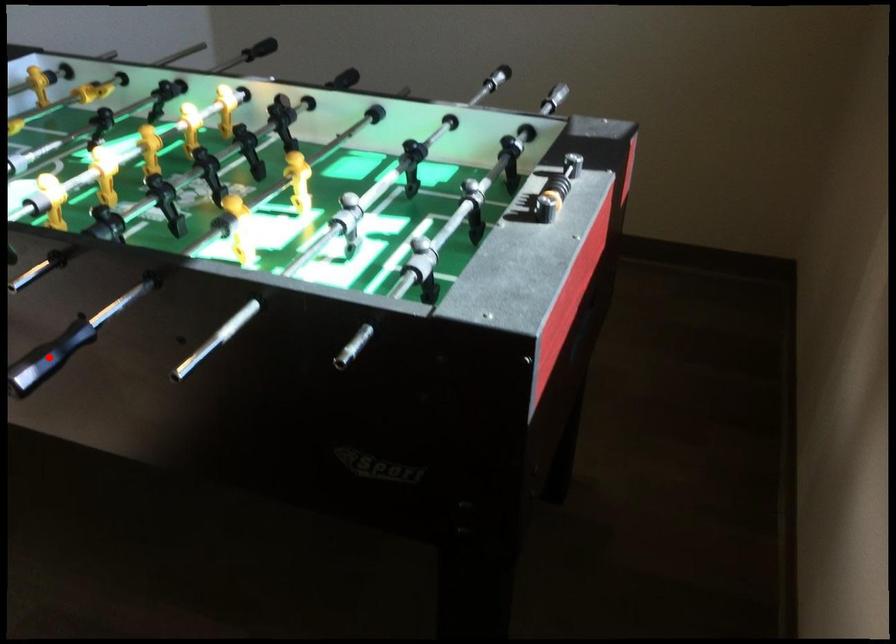
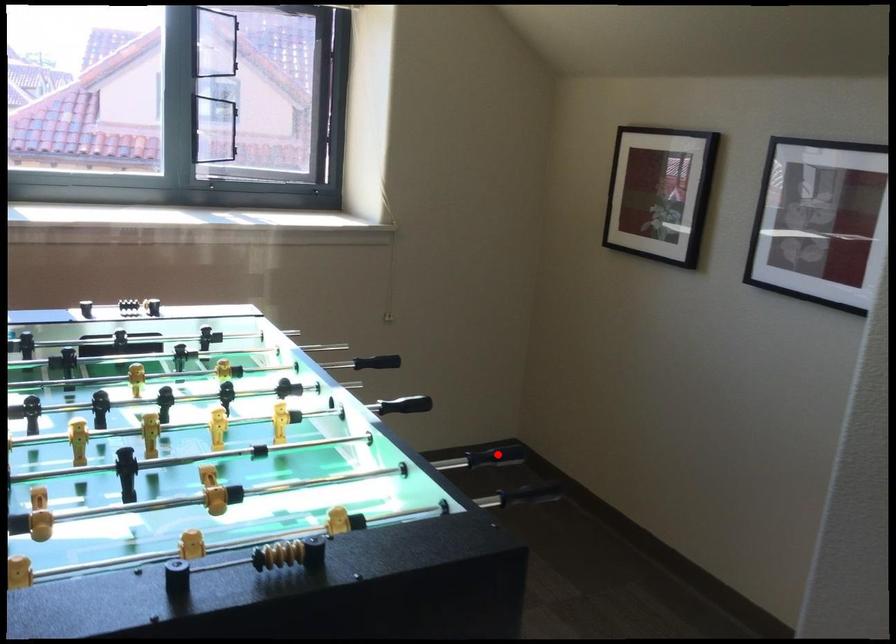
I am providing you with two images of the same scene from different viewpoints. A red point is marked on the first image and another point is marked on the second image. Do the highlighted points in image1 and image2 indicate the same real-world spot?

No